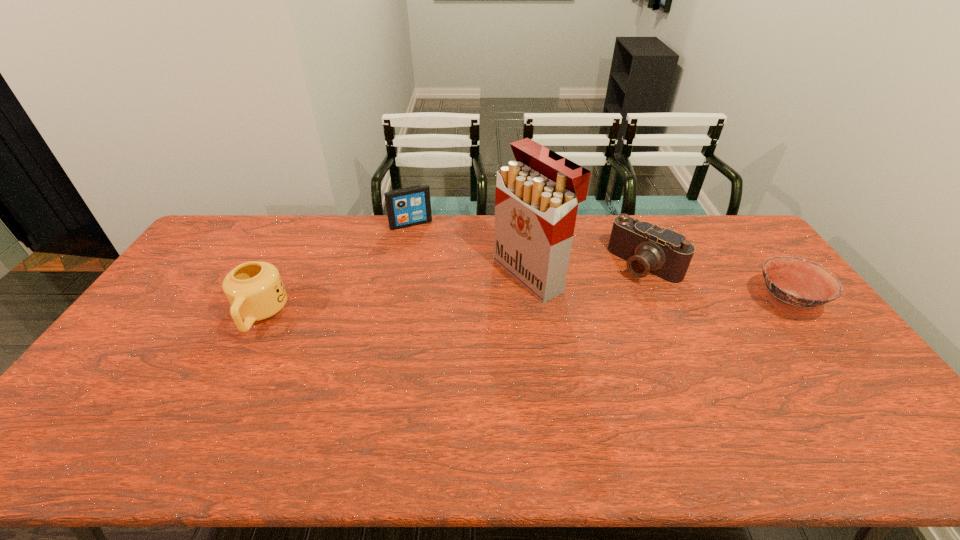
The width and height of the screenshot is (960, 540). In order to click on free space on the desktop that is between the leftmost object and the shortest object and is positioned on the front-facing side of the camera in this screenshot , I will do `click(597, 307)`.

The width and height of the screenshot is (960, 540). Identify the location of vacant space on the desktop that is between the mug and the rightmost object and is positioned with the lid open on the third object from left to right. (457, 310).

Image resolution: width=960 pixels, height=540 pixels. What are the coordinates of `free space on the desktop that is between the leftmost object and the shortest object and is positioned on the front screen of the fourth object from right to left` in the screenshot? It's located at (454, 310).